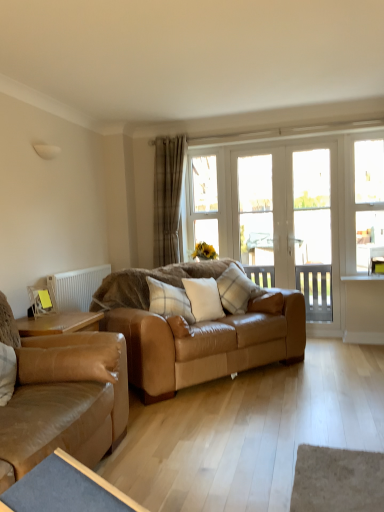
Question: In which direction should I rotate to look at clear glass door at center, the second window viewed from the right?

Choices:
 (A) left
 (B) right

Answer: (B)

Question: Are clear glass door at center, the second window viewed from the right, and leather couch at left, marked as the 2th studio couch in a back-to-front arrangement, located far from each other?

Choices:
 (A) yes
 (B) no

Answer: (A)

Question: Is clear glass door at center, the second window viewed from the right, to the right of leather couch at left, arranged as the 1th studio couch when viewed from the front, from the viewer's perspective?

Choices:
 (A) no
 (B) yes

Answer: (B)

Question: Considering the relative sizes of clear glass door at center, which appears as the second window when viewed from the left, and leather couch at left, marked as the 2th studio couch in a back-to-front arrangement, in the image provided, is clear glass door at center, which appears as the second window when viewed from the left, shorter than leather couch at left, marked as the 2th studio couch in a back-to-front arrangement,?

Choices:
 (A) no
 (B) yes

Answer: (A)

Question: Considering the relative sizes of clear glass door at center, the second window viewed from the right, and leather couch at left, marked as the 2th studio couch in a back-to-front arrangement, in the image provided, is clear glass door at center, the second window viewed from the right, smaller than leather couch at left, marked as the 2th studio couch in a back-to-front arrangement,?

Choices:
 (A) yes
 (B) no

Answer: (A)

Question: From the image's perspective, is clear glass door at center, the second window viewed from the right, on leather couch at left, marked as the 2th studio couch in a back-to-front arrangement?

Choices:
 (A) no
 (B) yes

Answer: (B)

Question: From a real-world perspective, is clear glass door at center, which appears as the second window when viewed from the left, located higher than leather couch at left, arranged as the 1th studio couch when viewed from the front?

Choices:
 (A) yes
 (B) no

Answer: (A)

Question: Is white plastic radiator at left closer to camera compared to white plaid pillow at center, the third pillow viewed from the right?

Choices:
 (A) no
 (B) yes

Answer: (A)

Question: From the image's perspective, is white plastic radiator at left located beneath white plaid pillow at center, the third pillow viewed from the right?

Choices:
 (A) no
 (B) yes

Answer: (A)

Question: Does white plastic radiator at left have a greater height compared to white plaid pillow at center, which is the first pillow from left to right?

Choices:
 (A) yes
 (B) no

Answer: (A)

Question: Is white plastic radiator at left thinner than white plaid pillow at center, the third pillow viewed from the right?

Choices:
 (A) no
 (B) yes

Answer: (B)

Question: Is white plastic radiator at left smaller than white plaid pillow at center, which is the first pillow from left to right?

Choices:
 (A) no
 (B) yes

Answer: (B)

Question: Considering the relative sizes of white plastic radiator at left and white plaid pillow at center, which is the first pillow from left to right, in the image provided, is white plastic radiator at left wider than white plaid pillow at center, which is the first pillow from left to right,?

Choices:
 (A) no
 (B) yes

Answer: (A)

Question: Does clear glass screen door at right, acting as the second screen door starting from the left, have a lesser height compared to white soft cushion at center, the second pillow positioned from the right?

Choices:
 (A) no
 (B) yes

Answer: (A)